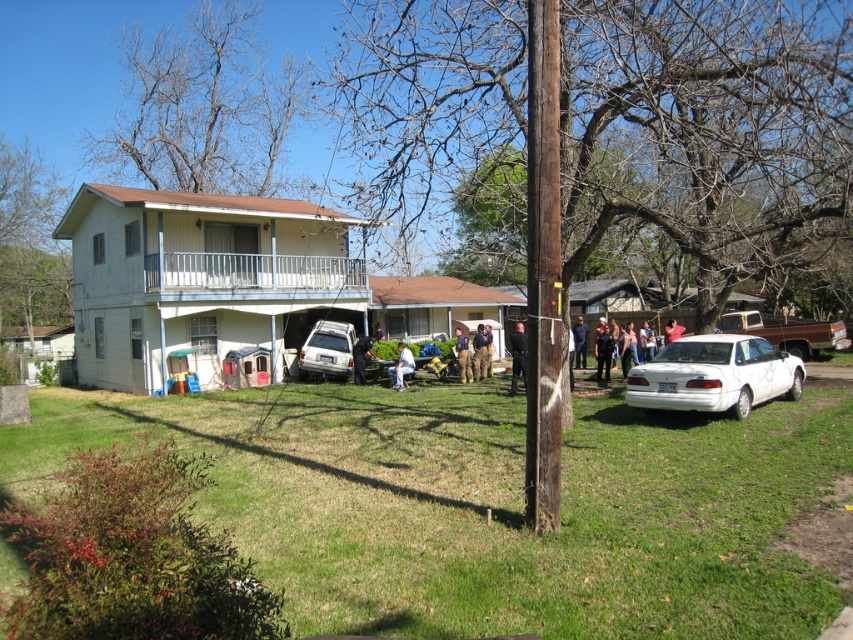
Question: Considering the relative positions of black uniform at center and white fabric chair at center in the image provided, where is black uniform at center located with respect to white fabric chair at center?

Choices:
 (A) right
 (B) left

Answer: (A)

Question: Which point is farther from the camera taking this photo?

Choices:
 (A) (672, 323)
 (B) (340, 348)
 (C) (393, 385)

Answer: (A)

Question: Estimate the real-world distances between objects in this image. Which object is closer to the black matte jacket at center?

Choices:
 (A) green grass at lower center
 (B) dark blue jeans at center
 (C) white fabric chair at center

Answer: (C)

Question: Considering the real-world distances, which object is farthest from the white metal porch at upper center?

Choices:
 (A) black uniform at center
 (B) black matte jacket at center
 (C) white matte van at center
 (D) red shirt at center

Answer: (D)

Question: Is black uniform at center above red shirt at center?

Choices:
 (A) yes
 (B) no

Answer: (B)

Question: Can you confirm if black uniform at center is positioned to the right of blue uniform pants at center?

Choices:
 (A) no
 (B) yes

Answer: (B)